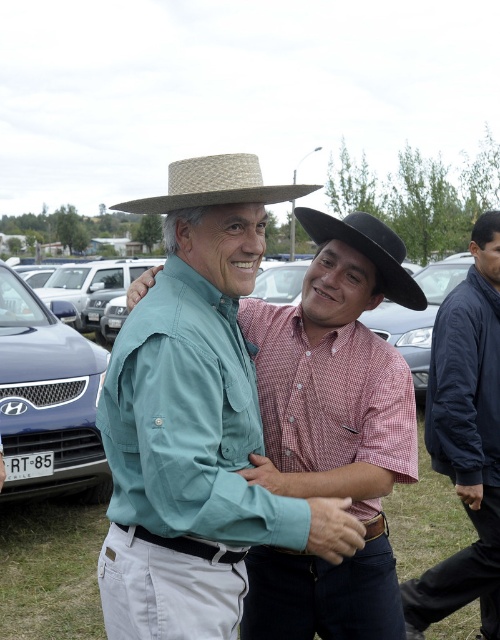
You are standing in the outdoor gathering area and want to determine which of the two points, point (17, 301) or point (391, 292), is closer to you. Based on the scene, which point is nearer?

Point (17, 301) is closer to you because it is further to the viewer than point (391, 292).

You are standing in the outdoor scene and want to determine which of the two points, point (480, 531) or point (70, 344), is nearer to you. Based on the description, which point is closer?

Point (480, 531) is closer to the viewer than point (70, 344).

You are standing in the middle of the grassy area and want to walk to the black felt fedora at center. Is the matte blue car at left blocking your path?

The matte blue car at left is to the left of black felt fedora at center, so it is not directly in your path. You can walk around the matte blue car at left to reach the black felt fedora at center.